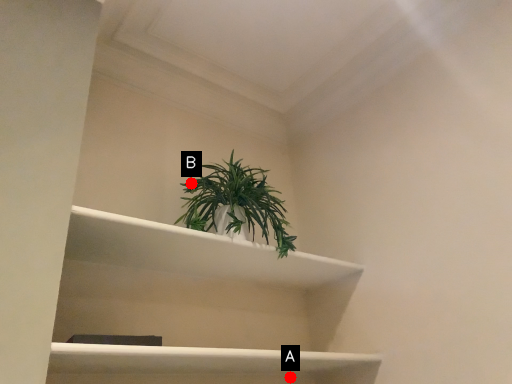
Question: Two points are circled on the image, labeled by A and B beside each circle. Among these points, which one is farthest from the camera?

Choices:
 (A) A is further
 (B) B is further

Answer: (B)